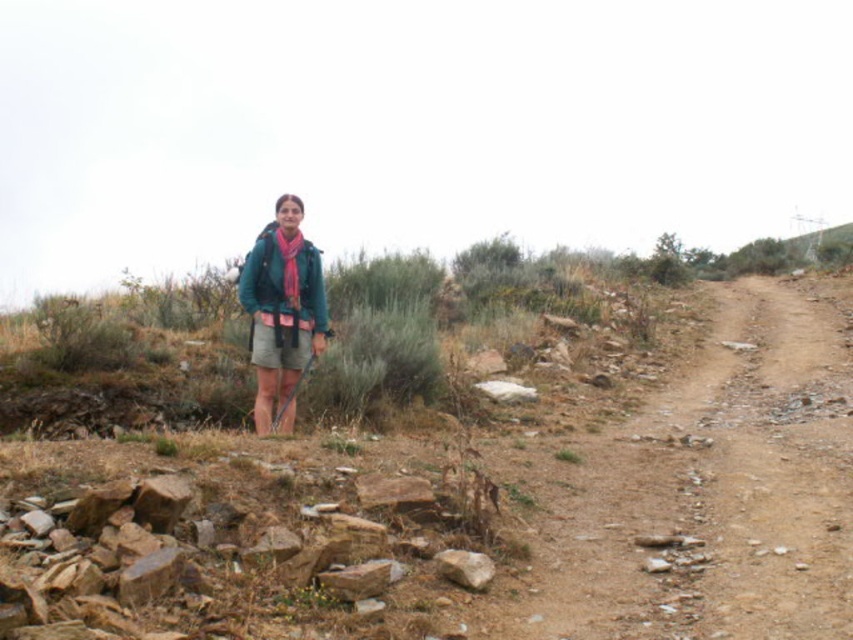
You are a hiker trying to navigate a rocky path. You see the rusty stone pile at lower left and the teal matte jacket at center. Which object is positioned lower in the image?

The rusty stone pile at lower left is located below the teal matte jacket at center, so it is positioned lower in the image.

You are a hiker who wants to place your backpack on the ground near the rusty stone pile at lower left and the teal matte jacket at center. Which object should you choose to place your backpack next to if you want it to be closer to the dirt path on the right?

The teal matte jacket at center is closer to the dirt path on the right, so you should place your backpack next to the teal matte jacket at center.